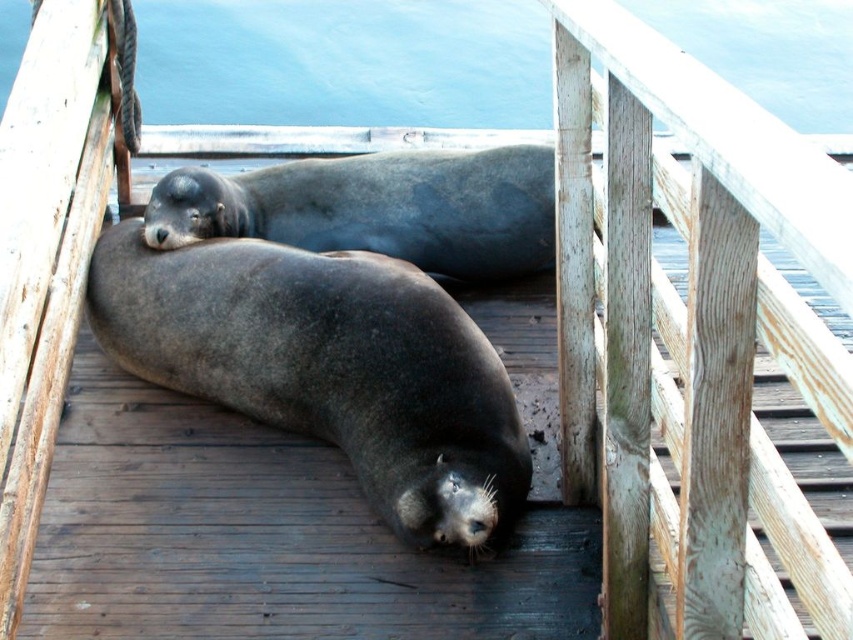
This screenshot has width=853, height=640. What do you see at coordinates (692, 332) in the screenshot? I see `weathered wood rail at upper center` at bounding box center [692, 332].

Is weathered wood rail at upper center to the left of blue water at upper center from the viewer's perspective?

Incorrect, weathered wood rail at upper center is not on the left side of blue water at upper center.

You are a GUI agent. You are given a task and a screenshot of the screen. Output one action in this format:
    pyautogui.click(x=<x>, y=<y>)
    Task: Click on the weathered wood rail at upper center
    The height and width of the screenshot is (640, 853).
    Given the screenshot: What is the action you would take?
    pyautogui.click(x=692, y=332)